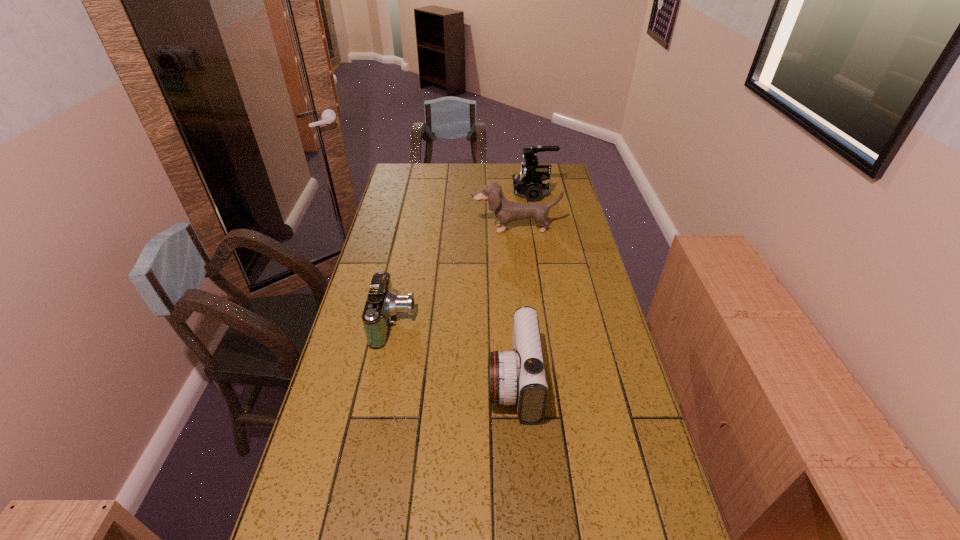
Identify the location of free space located 0.360m on the surface of the second shortest camcorder. The image size is (960, 540). (359, 381).

Identify the location of free space located 0.370m on the surface of the second shortest camcorder. (355, 381).

This screenshot has height=540, width=960. Identify the location of vacant region located 0.300m on the surface of the second shortest camcorder. (380, 381).

Identify the location of free location located 0.050m on the front-facing side of the shortest camcorder. This screenshot has width=960, height=540. (431, 322).

At what (x,y) coordinates should I click in order to perform the action: click on object positioned at the far edge. Please return your answer as a coordinate pair (x, y). This screenshot has height=540, width=960. Looking at the image, I should click on (532, 183).

Find the location of `object present at the left edge`. object present at the left edge is located at coordinates (382, 303).

The image size is (960, 540). Identify the location of camcorder that is at the right edge. (532, 183).

What are the coordinates of `puppy at the right edge` in the screenshot? It's located at (506, 211).

Image resolution: width=960 pixels, height=540 pixels. I want to click on object situated at the far right corner, so click(532, 183).

The height and width of the screenshot is (540, 960). In the image, there is a desktop. Identify the location of vacant space at the far edge. (430, 186).